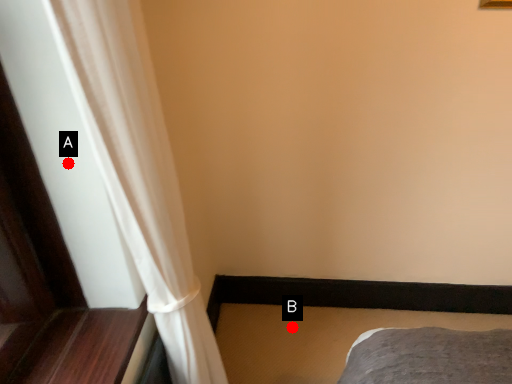
Question: Two points are circled on the image, labeled by A and B beside each circle. Which point is closer to the camera taking this photo?

Choices:
 (A) A is closer
 (B) B is closer

Answer: (A)